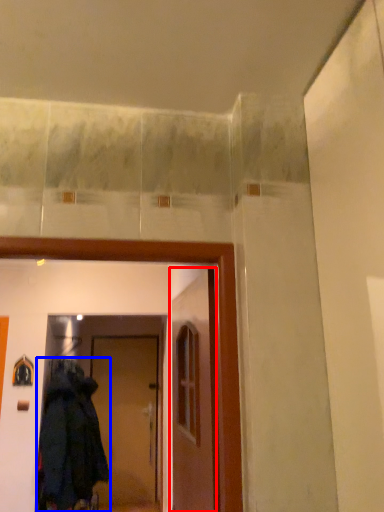
Question: Which of the following is the farthest to the observer, door (highlighted by a red box) or coat (highlighted by a blue box)?

Choices:
 (A) door
 (B) coat

Answer: (B)